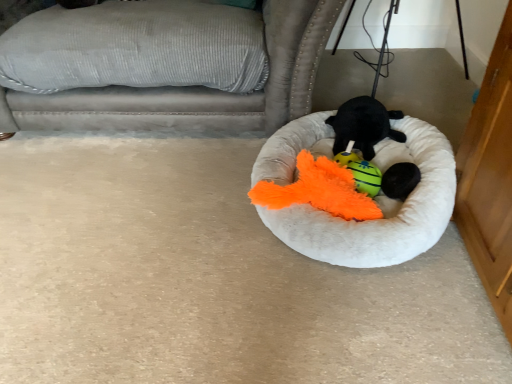
Where is `vacant space that is to the left of white fluffy dog bed at center`? vacant space that is to the left of white fluffy dog bed at center is located at coordinates (161, 213).